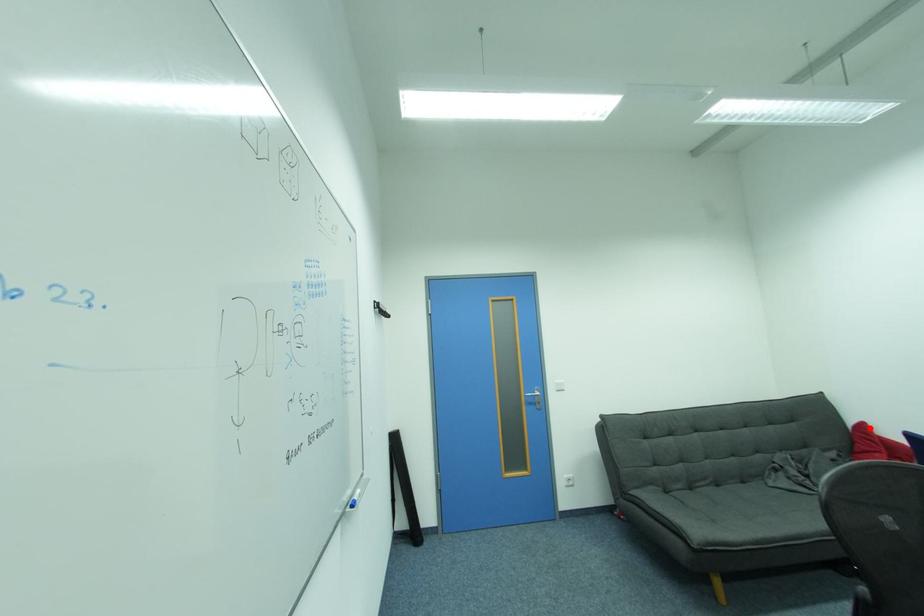
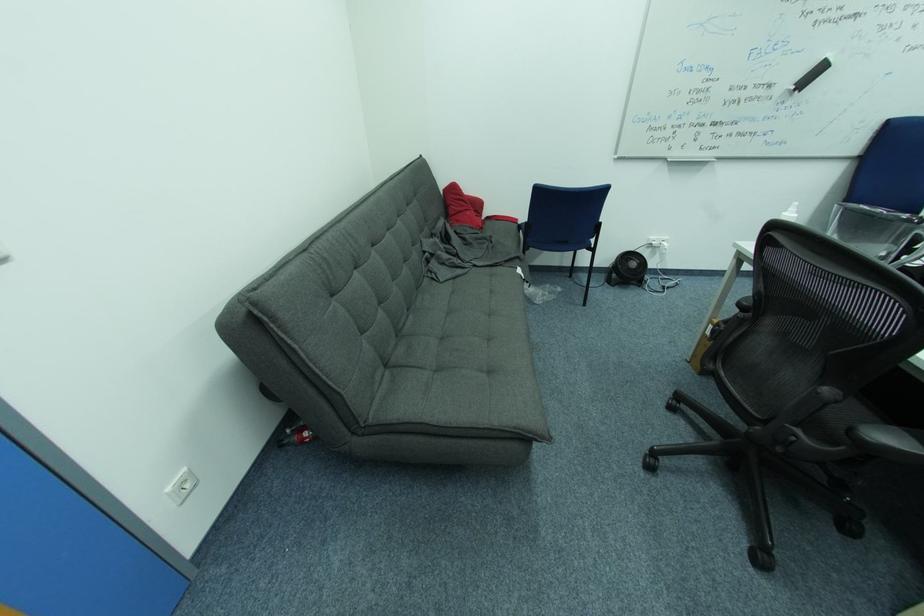
In the second image, find the point that corresponds to the highlighted location in the first image.

(459, 188)